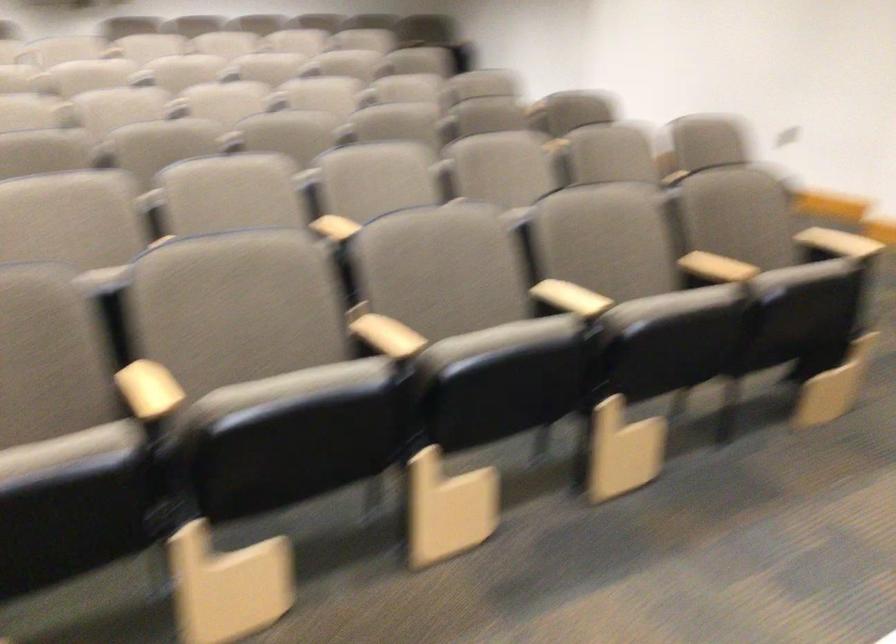
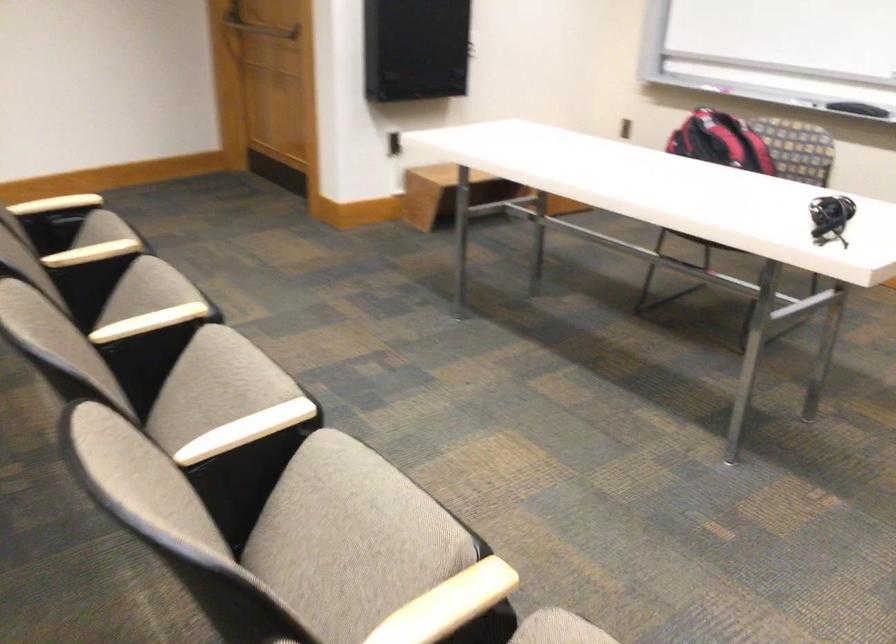
Find the pixel in the second image that matches pixel 561 298 in the first image.

(149, 322)